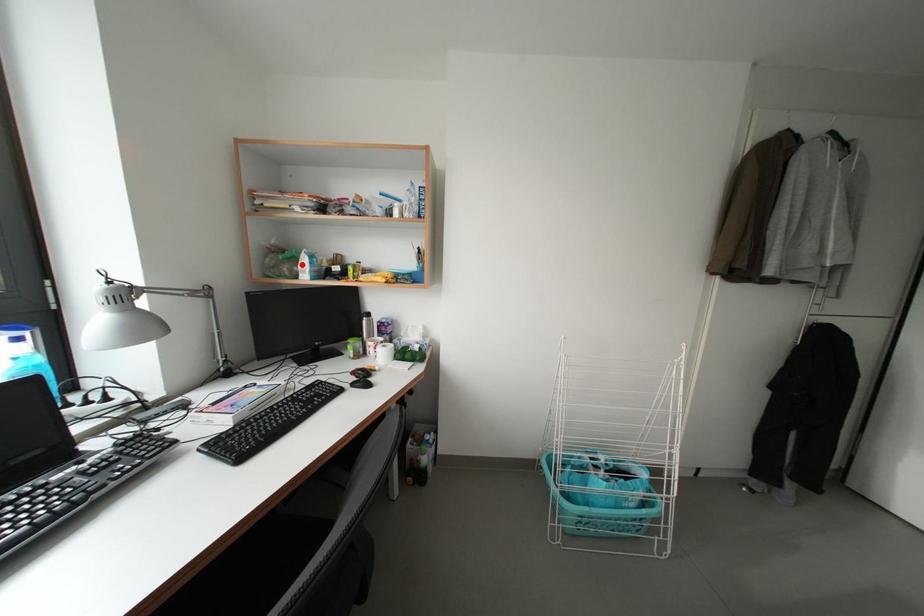
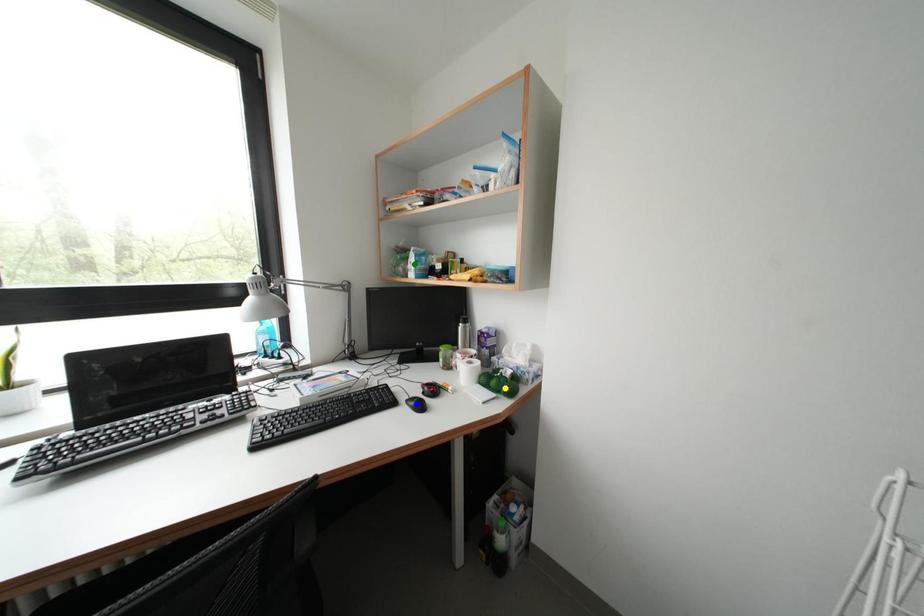
Question: I am providing you with two images of the same scene from different viewpoints. A red point is marked on the first image. You are given multiple points on the second image. Which mark in image 2 goes with the point in image 1?

Choices:
 (A) green point
 (B) yellow point
 (C) blue point

Answer: (A)